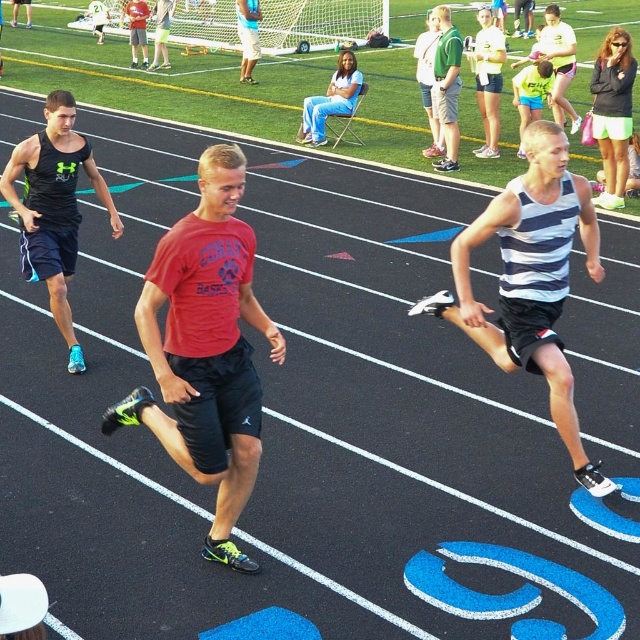
Question: Is matte black shorts at center to the left of matte red shirt at center from the viewer's perspective?

Choices:
 (A) yes
 (B) no

Answer: (A)

Question: From the image, what is the correct spatial relationship of striped tank top at right in relation to blue jeans at center?

Choices:
 (A) left
 (B) right

Answer: (B)

Question: Which object is farther from the camera taking this photo?

Choices:
 (A) matte black shorts at center
 (B) matte red shirt at center

Answer: (A)

Question: Which object appears farthest from the camera in this image?

Choices:
 (A) matte black shorts at center
 (B) striped tank top at right

Answer: (A)

Question: Which of these objects is positioned farthest from the matte red shirt at center?

Choices:
 (A) red matte t-shirt at center
 (B) matte black shorts at center
 (C) blue jeans at center

Answer: (A)

Question: Does striped tank top at right have a lesser width compared to matte black tank top at left?

Choices:
 (A) yes
 (B) no

Answer: (B)